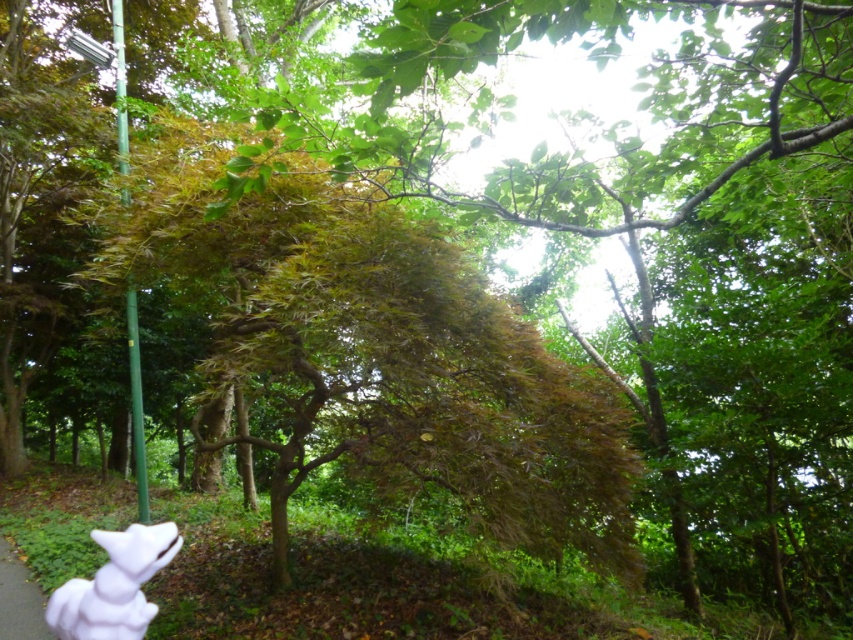
Measure the distance between point (137, 541) and camera.

Point (137, 541) is 2.86 meters away from camera.

Is white matte fox at lower left bigger than green grass at lower left?

No, white matte fox at lower left is not bigger than green grass at lower left.

Does point (62, 624) come farther from viewer compared to point (15, 593)?

No.

At what (x,y) coordinates should I click in order to perform the action: click on white matte fox at lower left. Please return your answer as a coordinate pair (x, y). The width and height of the screenshot is (853, 640). Looking at the image, I should click on (114, 586).